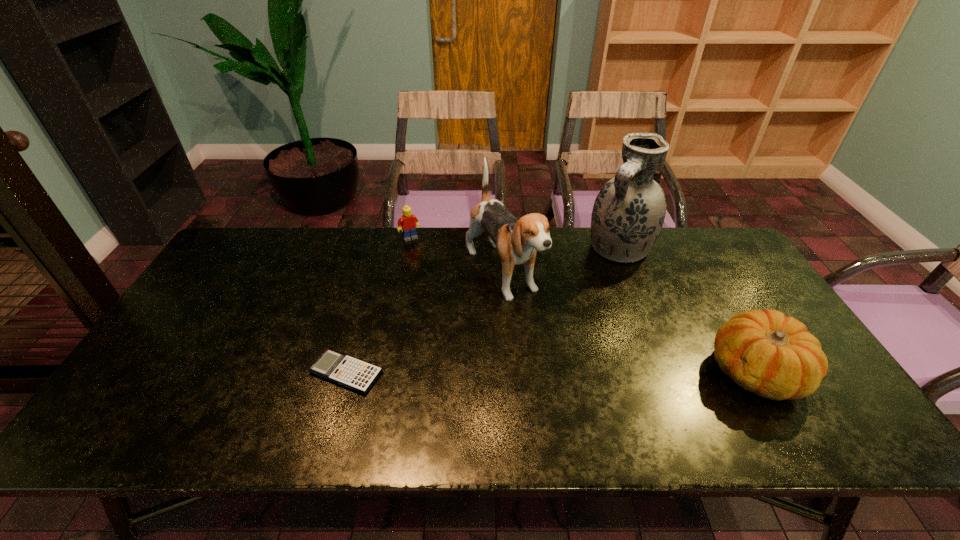
This screenshot has width=960, height=540. Identify the location of vacant space on the desktop that is between the calculator and the gourd and is positioned at the face of the fourth shortest object. (583, 372).

Where is `free space on the desktop that is between the calculator and the gourd and is positioned on the front-facing side of the Lego`? This screenshot has height=540, width=960. free space on the desktop that is between the calculator and the gourd and is positioned on the front-facing side of the Lego is located at coordinates (490, 372).

Identify the location of vacant space on the desktop that is between the shortest object and the gourd and is positioned with the handle on the side of the vase. (517, 372).